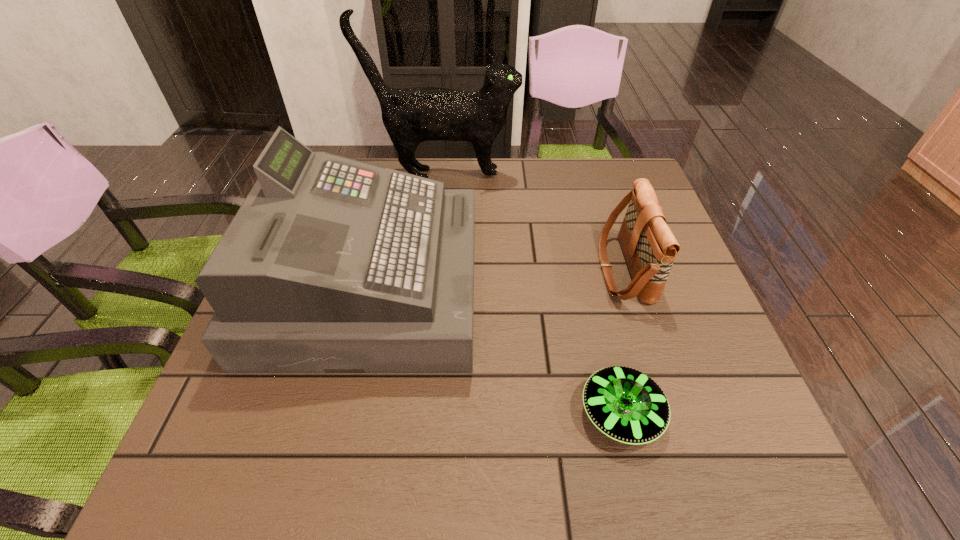
At what (x,y) coordinates should I click in order to perform the action: click on free region at the far edge of the desktop. Please return your answer as a coordinate pair (x, y). The width and height of the screenshot is (960, 540). Looking at the image, I should click on (492, 161).

In the image, there is a desktop. In order to click on vacant space at the left edge in this screenshot , I will do `click(300, 377)`.

At what (x,y) coordinates should I click in order to perform the action: click on free space at the right edge of the desktop. Please return your answer as a coordinate pair (x, y). The height and width of the screenshot is (540, 960). Looking at the image, I should click on [x=626, y=270].

The height and width of the screenshot is (540, 960). What are the coordinates of `free space at the far right corner of the desktop` in the screenshot? It's located at (630, 168).

Find the location of `free space that is in between the shoulder bag and the saucer`. free space that is in between the shoulder bag and the saucer is located at coordinates (622, 341).

Find the location of a particular element. vacant space that is in between the farthest object and the shortest object is located at coordinates (532, 294).

This screenshot has height=540, width=960. Identify the location of unoccupied area between the tallest object and the shoulder bag. tap(534, 222).

Locate an element on the screen. This screenshot has height=540, width=960. empty space that is in between the second shortest object and the second tallest object is located at coordinates (496, 278).

You are a GUI agent. You are given a task and a screenshot of the screen. Output one action in this format:
    pyautogui.click(x=<x>, y=<y>)
    Task: Click on the unoccupied area between the shortest object and the second tallest object
    
    Given the screenshot: What is the action you would take?
    pyautogui.click(x=495, y=350)

Identify the location of vacant point located between the nearest object and the cat. The width and height of the screenshot is (960, 540). (532, 294).